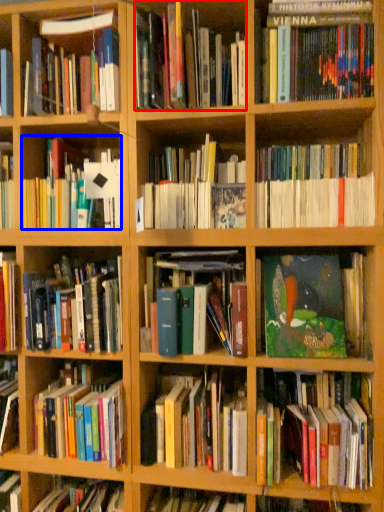
Question: Among these objects, which one is nearest to the camera, book (highlighted by a red box) or book (highlighted by a blue box)?

Choices:
 (A) book
 (B) book

Answer: (A)